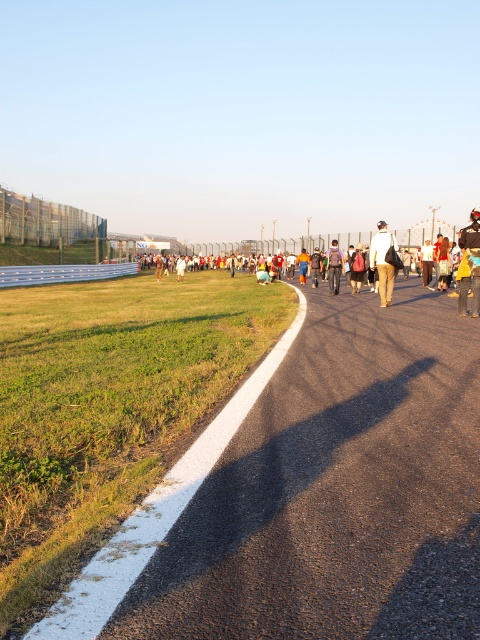
Consider the image. Measure the distance from khaki pants at center to matte black jacket at center.

khaki pants at center is 2.48 meters away from matte black jacket at center.

Between point (379, 244) and point (332, 243), which one is positioned in front?

Point (379, 244) is more forward.

Find the location of a particular element. The width and height of the screenshot is (480, 640). khaki pants at center is located at coordinates [383, 260].

In the scene shown: How far apart are asphalt at center and matte black jacket at center?

The distance of asphalt at center from matte black jacket at center is 8.77 meters.

Can you confirm if asphalt at center is wider than matte black jacket at center?

Yes.

Who is more forward, (432, 580) or (330, 280)?

Point (432, 580) is more forward.

This screenshot has width=480, height=640. I want to click on asphalt at center, so click(312, 493).

Is white casual clothing at center below matte black jacket at center?

No.

Which is below, white casual clothing at center or matte black jacket at center?

Positioned lower is matte black jacket at center.

Which is in front, point (471, 316) or point (327, 273)?

Point (471, 316) is in front.

Image resolution: width=480 pixels, height=640 pixels. Identify the location of white casual clothing at center. (376, 262).